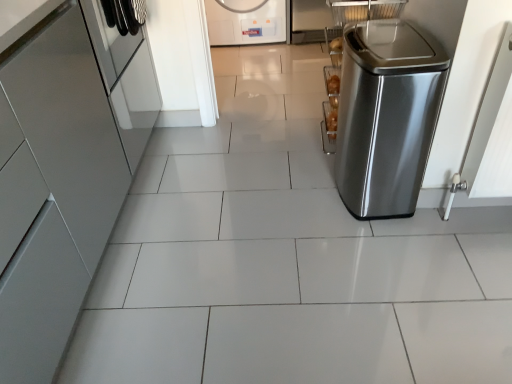
Where is `free space that is to the left of stainless steel trash can at right, which appears as the first home appliance when viewed from the right`? The height and width of the screenshot is (384, 512). free space that is to the left of stainless steel trash can at right, which appears as the first home appliance when viewed from the right is located at coordinates (297, 191).